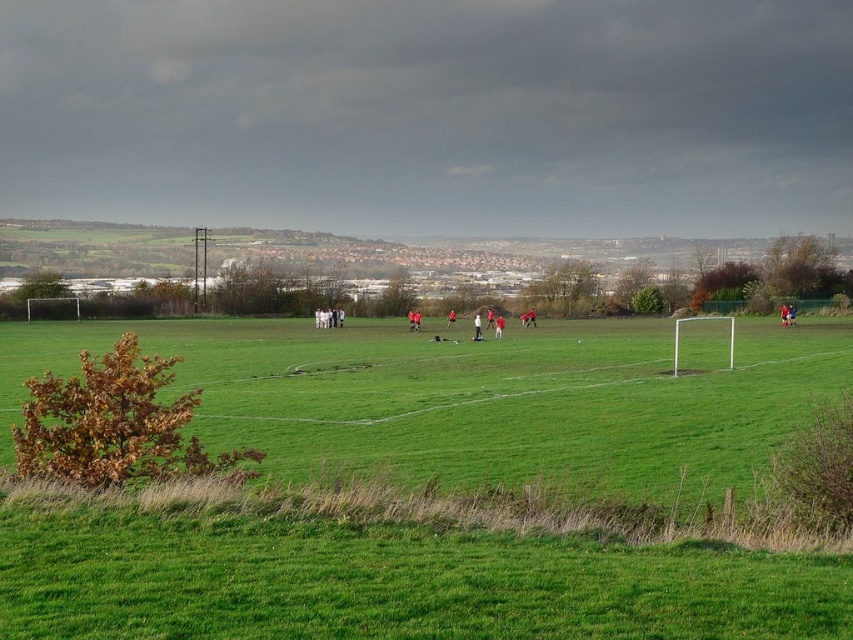
Question: Does green grass field at center have a smaller size compared to matte red soccer ball at center?

Choices:
 (A) yes
 (B) no

Answer: (B)

Question: Considering the relative positions of matte red soccer ball at center and red jersey at center in the image provided, where is matte red soccer ball at center located with respect to red jersey at center?

Choices:
 (A) below
 (B) above

Answer: (A)

Question: Which of the following is the closest to the observer?

Choices:
 (A) (524, 438)
 (B) (531, 316)
 (C) (502, 324)

Answer: (A)

Question: Estimate the real-world distances between objects in this image. Which object is farther from the red jersey at center?

Choices:
 (A) green grass field at center
 (B) matte red soccer ball at center

Answer: (A)

Question: Which point is closer to the camera taking this photo?

Choices:
 (A) (643, 496)
 (B) (477, 323)
 (C) (498, 337)

Answer: (A)

Question: Does matte red soccer ball at center appear under red jersey soccer player at center?

Choices:
 (A) yes
 (B) no

Answer: (B)